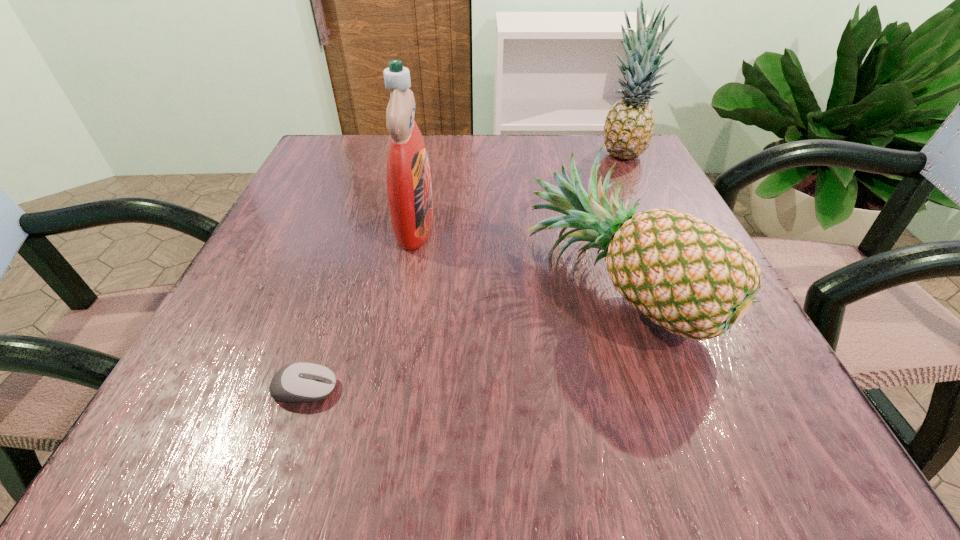
Identify which object is the closest to the detergent. Please provide its 2D coordinates. Your answer should be formatted as a tuple, i.e. [(x, y)], where the tuple contains the x and y coordinates of a point satisfying the conditions above.

[(684, 274)]

Locate which object ranks in proximity to the nearer pineapple. Please provide its 2D coordinates. Your answer should be formatted as a tuple, i.e. [(x, y)], where the tuple contains the x and y coordinates of a point satisfying the conditions above.

[(409, 188)]

The image size is (960, 540). Find the location of `free space that satisfies the following two spatial constraints: 1. on the front side of the second shortest object; 2. on the wheel side of the computer equipment`. free space that satisfies the following two spatial constraints: 1. on the front side of the second shortest object; 2. on the wheel side of the computer equipment is located at coordinates (647, 389).

Identify the location of blank space that satisfies the following two spatial constraints: 1. on the front side of the taller pineapple; 2. on the front surface of the third object from right to left. (655, 225).

Where is `vacant space that satisfies the following two spatial constraints: 1. on the front side of the shorter pineapple; 2. on the wheel side of the computer equipment`? The image size is (960, 540). vacant space that satisfies the following two spatial constraints: 1. on the front side of the shorter pineapple; 2. on the wheel side of the computer equipment is located at coordinates (647, 389).

Locate an element on the screen. blank space that satisfies the following two spatial constraints: 1. on the front surface of the nearer pineapple; 2. on the left side of the detergent is located at coordinates (404, 286).